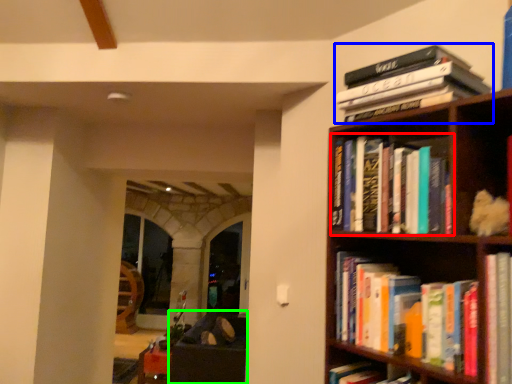
Question: Which object is the farthest from book (highlighted by a red box)? Choose among these: book (highlighted by a blue box) or furniture (highlighted by a green box).

Choices:
 (A) book
 (B) furniture

Answer: (B)